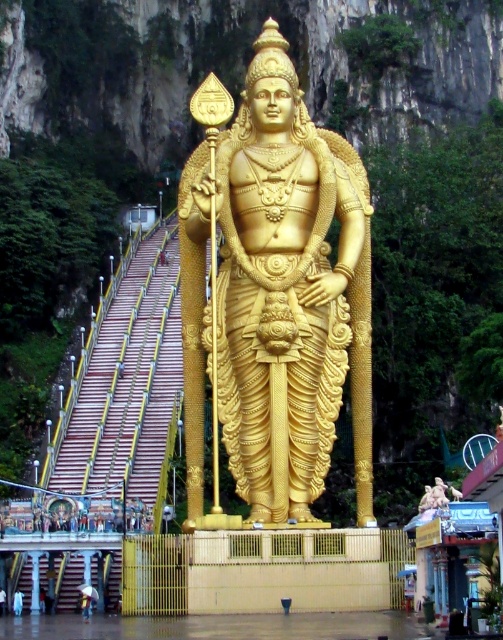
In the scene shown: You are a photographer standing at the base of the stairs. You want to take a photo of the gold polished statue at center. Given that your camera has a maximum focus range of 60 meters, will you be able to capture the statue clearly?

The gold polished statue at center is 59.61 meters away from the camera. Since the camera can focus up to 60 meters, it is within the range, so yes, you can capture the statue clearly.

You are an architect designing a new garden layout. You need to place a 3m tall decorative column between the gold polished statue at center and the golden statue at center. Which statue should the column be closer to, based on their heights?

The gold polished statue at center is taller than the golden statue at center. Therefore, the column should be placed closer to the golden statue at center to maintain visual balance between the two statues.

In the scene shown: You are standing at the base of the stairs leading to the temple and see two points marked in the scene. The first point is at coordinates point (362,196) and the second is at point (42,518). Which of these two points is closer to you?

Point (362,196) is closer to the viewer than point (42,518).